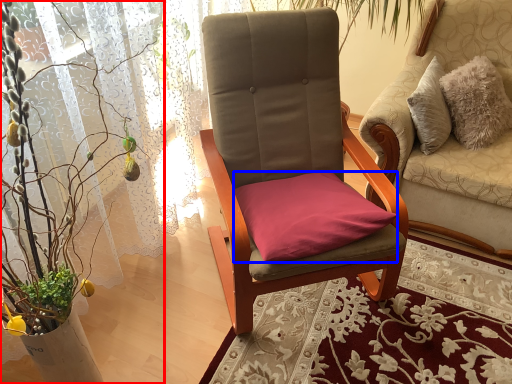
Question: Which of the following is the closest to the observer, houseplant (highlighted by a red box) or pillow (highlighted by a blue box)?

Choices:
 (A) houseplant
 (B) pillow

Answer: (A)